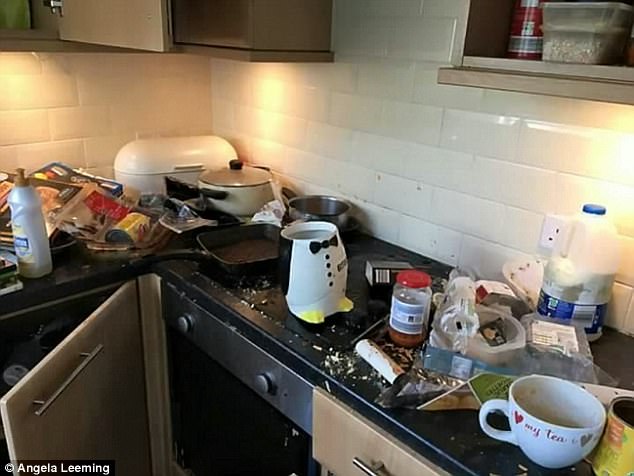
Identify the location of upper cabinet. The width and height of the screenshot is (634, 476). (272, 29).